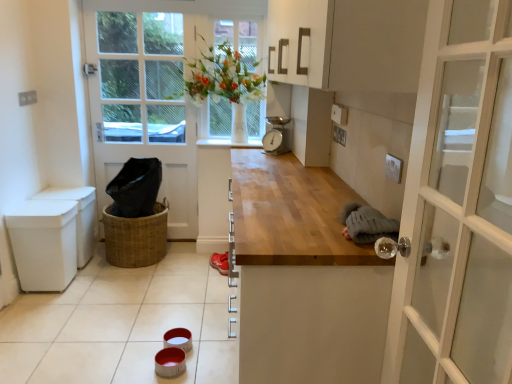
Find the location of a particular element. This screenshot has width=512, height=384. vacant space situated above white glossy tile at lower center (from a real-world perspective) is located at coordinates (139, 308).